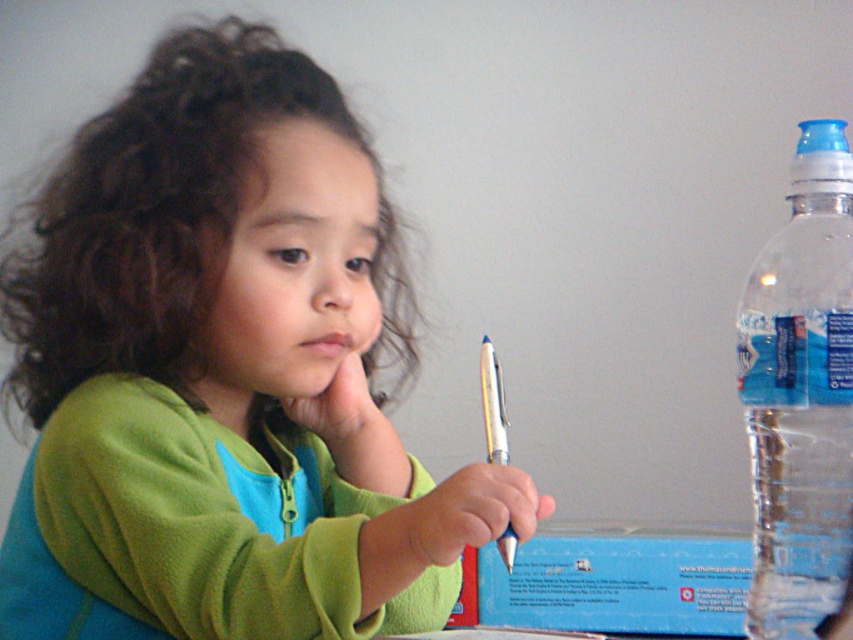
Question: Observing the image, what is the correct spatial positioning of green fleece jacket at center in reference to transparent plastic bottle at right?

Choices:
 (A) above
 (B) below

Answer: (A)

Question: Which point is farther from the camera taking this photo?

Choices:
 (A) (71, 582)
 (B) (485, 435)

Answer: (B)

Question: Does green fleece jacket at center appear on the right side of transparent plastic bottle at right?

Choices:
 (A) yes
 (B) no

Answer: (B)

Question: Among these objects, which one is nearest to the camera?

Choices:
 (A) green fleece jacket at center
 (B) transparent plastic bottle at right

Answer: (A)

Question: Which object is the farthest from the green fleece jacket at center?

Choices:
 (A) transparent plastic bottle at right
 (B) metallic blue pen at center

Answer: (A)

Question: Can you confirm if green fleece jacket at center is smaller than transparent plastic bottle at right?

Choices:
 (A) no
 (B) yes

Answer: (A)